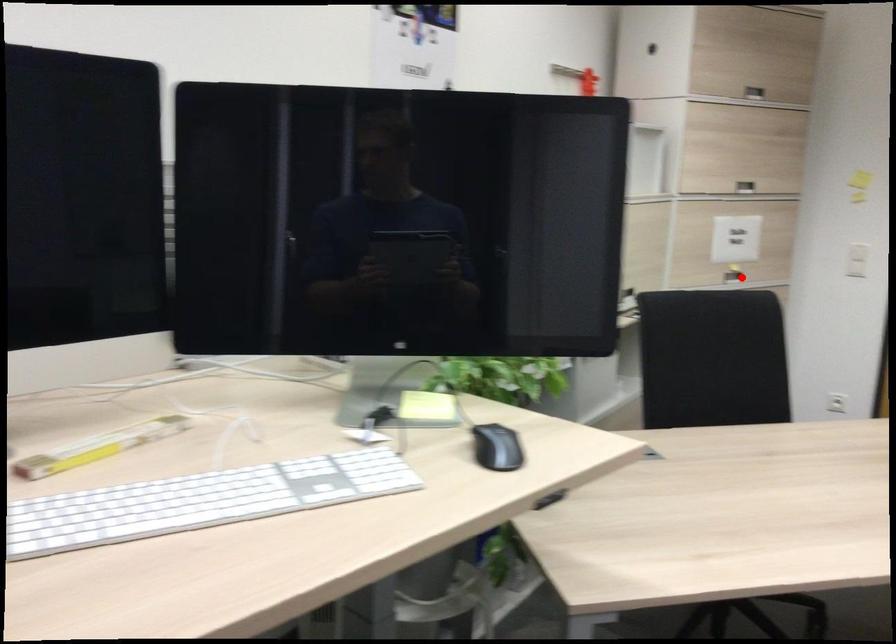
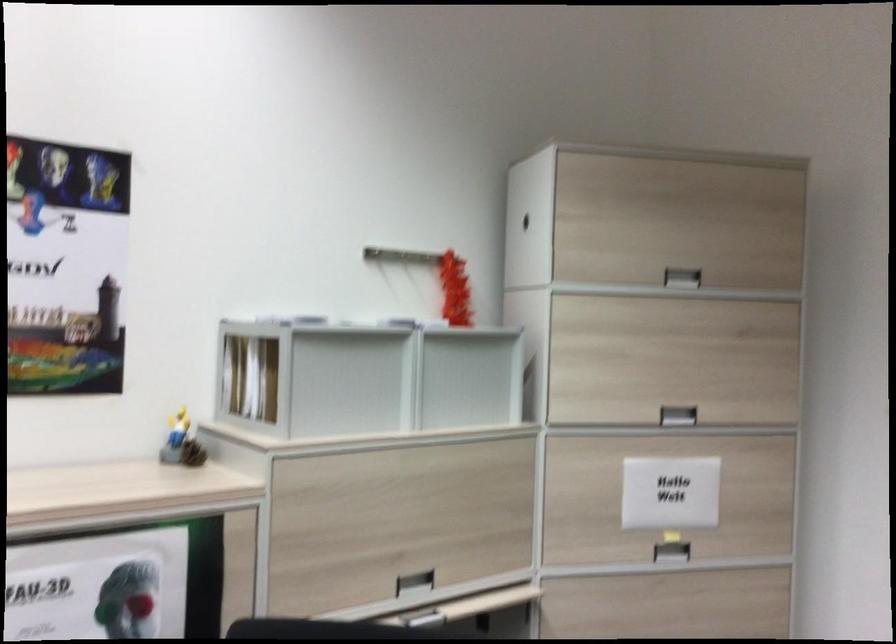
Question: A red point is marked in image1. In image2, is the corresponding 3D point closer to the camera or farther? Reply with the corresponding letter.

Choices:
 (A) The corresponding 3D point is closer.
 (B) The corresponding 3D point is farther.

Answer: (A)